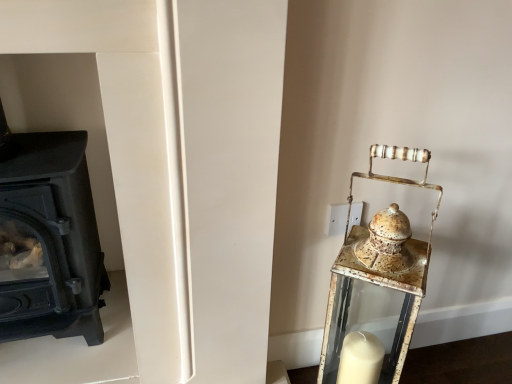
The height and width of the screenshot is (384, 512). What are the coordinates of `black matte wood burning stove at left` in the screenshot? It's located at (49, 241).

What do you see at coordinates (49, 241) in the screenshot? I see `black matte wood burning stove at left` at bounding box center [49, 241].

Measure the distance between point (63, 202) and camera.

Point (63, 202) and camera are 39.09 inches apart.

What is the approximate width of black matte wood burning stove at left?

The width of black matte wood burning stove at left is 35.98 centimeters.

What is the approximate height of rusty metal lantern at right?

rusty metal lantern at right is 72.82 centimeters in height.

The width and height of the screenshot is (512, 384). Find the location of `rusty metal lantern at right`. rusty metal lantern at right is located at coordinates (380, 268).

The width and height of the screenshot is (512, 384). What do you see at coordinates (380, 268) in the screenshot? I see `rusty metal lantern at right` at bounding box center [380, 268].

Locate an element on the screen. black matte wood burning stove at left is located at coordinates (49, 241).

Is black matte wood burning stove at left to the right of rusty metal lantern at right from the viewer's perspective?

In fact, black matte wood burning stove at left is to the left of rusty metal lantern at right.

Is the depth of black matte wood burning stove at left greater than that of rusty metal lantern at right?

Yes, the depth of black matte wood burning stove at left is greater than that of rusty metal lantern at right.

Is point (44, 208) closer or farther from the camera than point (417, 161)?

Point (44, 208) is farther from the camera than point (417, 161).

From the image's perspective, which one is positioned lower, black matte wood burning stove at left or rusty metal lantern at right?

From the image's view, rusty metal lantern at right is below.

From a real-world perspective, does black matte wood burning stove at left stand above rusty metal lantern at right?

Yes, from a real-world perspective, black matte wood burning stove at left is on top of rusty metal lantern at right.

Which object is thinner, black matte wood burning stove at left or rusty metal lantern at right?

rusty metal lantern at right.

Is black matte wood burning stove at left shorter than rusty metal lantern at right?

In fact, black matte wood burning stove at left may be taller than rusty metal lantern at right.

Which of these two, black matte wood burning stove at left or rusty metal lantern at right, is bigger?

Bigger between the two is black matte wood burning stove at left.

Is black matte wood burning stove at left spatially inside rusty metal lantern at right, or outside of it?

black matte wood burning stove at left cannot be found inside rusty metal lantern at right.

Are black matte wood burning stove at left and rusty metal lantern at right far apart?

They are positioned close to each other.

Is black matte wood burning stove at left facing away from rusty metal lantern at right?

No, black matte wood burning stove at left's orientation is not away from rusty metal lantern at right.

Image resolution: width=512 pixels, height=384 pixels. Find the location of `wood burning stove above the rusty metal lantern at right (from the image's perspective)`. wood burning stove above the rusty metal lantern at right (from the image's perspective) is located at coordinates (49, 241).

Based on their positions, is rusty metal lantern at right located to the left or right of black matte wood burning stove at left?

rusty metal lantern at right is to the right of black matte wood burning stove at left.

Consider the image. In the image, is rusty metal lantern at right positioned in front of or behind black matte wood burning stove at left?

rusty metal lantern at right is in front of black matte wood burning stove at left.

Which is more distant, (411, 310) or (21, 217)?

The point (21, 217) is farther from the camera.

From the image's perspective, is rusty metal lantern at right above black matte wood burning stove at left?

No, from the image's perspective, rusty metal lantern at right is not over black matte wood burning stove at left.

From a real-world perspective, relative to black matte wood burning stove at left, is rusty metal lantern at right vertically above or below?

rusty metal lantern at right is situated lower than black matte wood burning stove at left in the real world.

Is rusty metal lantern at right wider than black matte wood burning stove at left?

No, rusty metal lantern at right is not wider than black matte wood burning stove at left.

In terms of height, does rusty metal lantern at right look taller or shorter compared to black matte wood burning stove at left?

In the image, rusty metal lantern at right appears to be shorter than black matte wood burning stove at left.

Looking at this image, between rusty metal lantern at right and black matte wood burning stove at left, which one has larger size?

black matte wood burning stove at left.

Would you say rusty metal lantern at right contains black matte wood burning stove at left?

No.

Is rusty metal lantern at right far away from black matte wood burning stove at left?

No, rusty metal lantern at right is in close proximity to black matte wood burning stove at left.

Consider the image. Is rusty metal lantern at right oriented away from black matte wood burning stove at left?

No, black matte wood burning stove at left is not at the back of rusty metal lantern at right.

Can you tell me how much rusty metal lantern at right and black matte wood burning stove at left differ in facing direction?

The angle between the facing direction of rusty metal lantern at right and the facing direction of black matte wood burning stove at left is 36.4 degrees.

At what (x,y) coordinates should I click in order to perform the action: click on table lamp located below the black matte wood burning stove at left (from the image's perspective). Please return your answer as a coordinate pair (x, y). This screenshot has height=384, width=512. Looking at the image, I should click on (380, 268).

The height and width of the screenshot is (384, 512). What are the coordinates of `wood burning stove that appears above the rusty metal lantern at right (from the image's perspective)` in the screenshot? It's located at coord(49,241).

Where is `wood burning stove behind the rusty metal lantern at right`? This screenshot has width=512, height=384. wood burning stove behind the rusty metal lantern at right is located at coordinates click(49, 241).